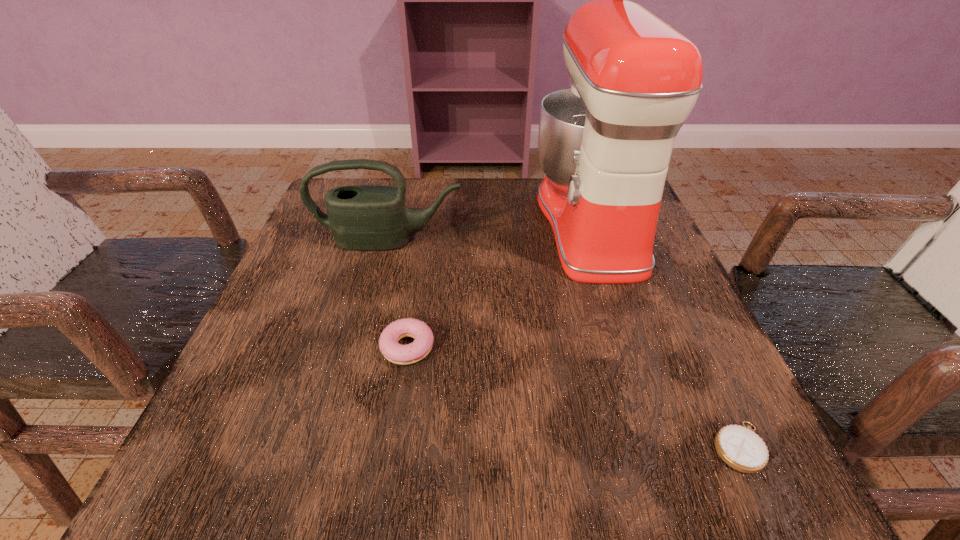
Where is `free space that satisfies the following two spatial constraints: 1. on the spout of the compass; 2. on the left side of the second tallest object`? The image size is (960, 540). free space that satisfies the following two spatial constraints: 1. on the spout of the compass; 2. on the left side of the second tallest object is located at coordinates (335, 447).

Locate an element on the screen. The height and width of the screenshot is (540, 960). blank area in the image that satisfies the following two spatial constraints: 1. on the spout of the third farthest object; 2. on the left side of the third shortest object is located at coordinates (361, 347).